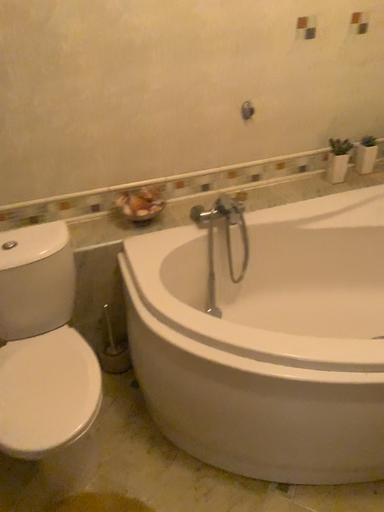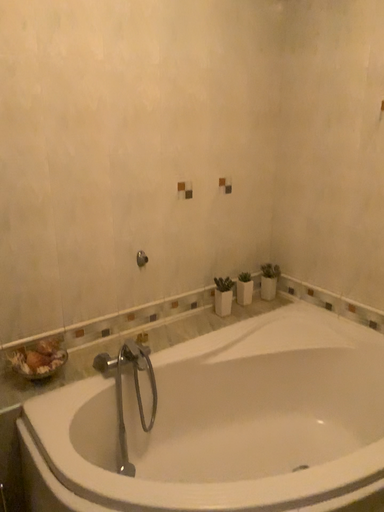
Question: Which way did the camera rotate in the video?

Choices:
 (A) rotated upward
 (B) rotated downward

Answer: (A)